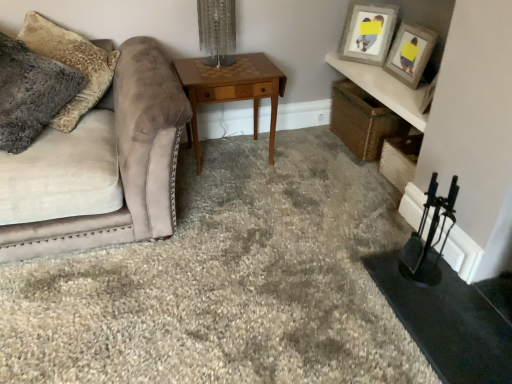
I want to click on free point in front of clear glass table lamp at center, so click(x=216, y=77).